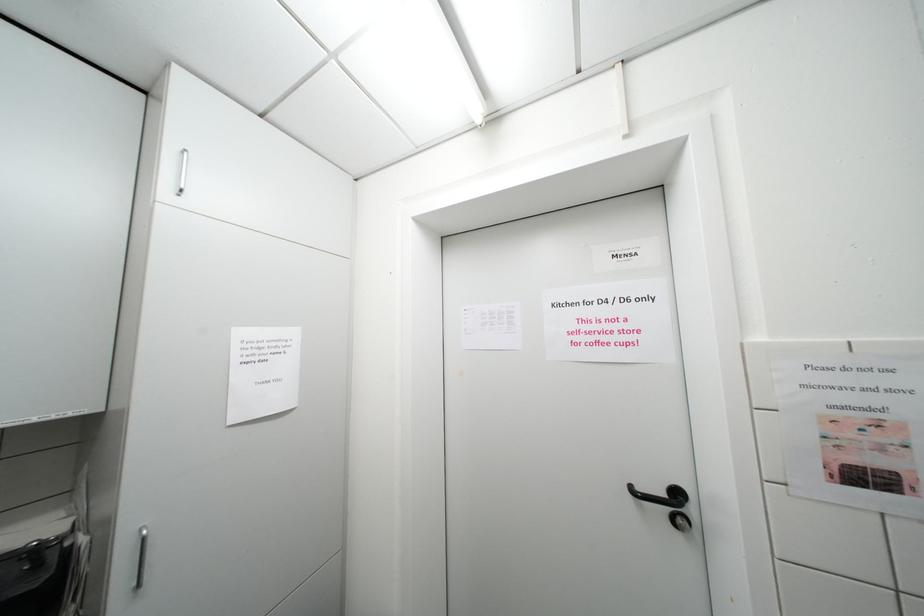
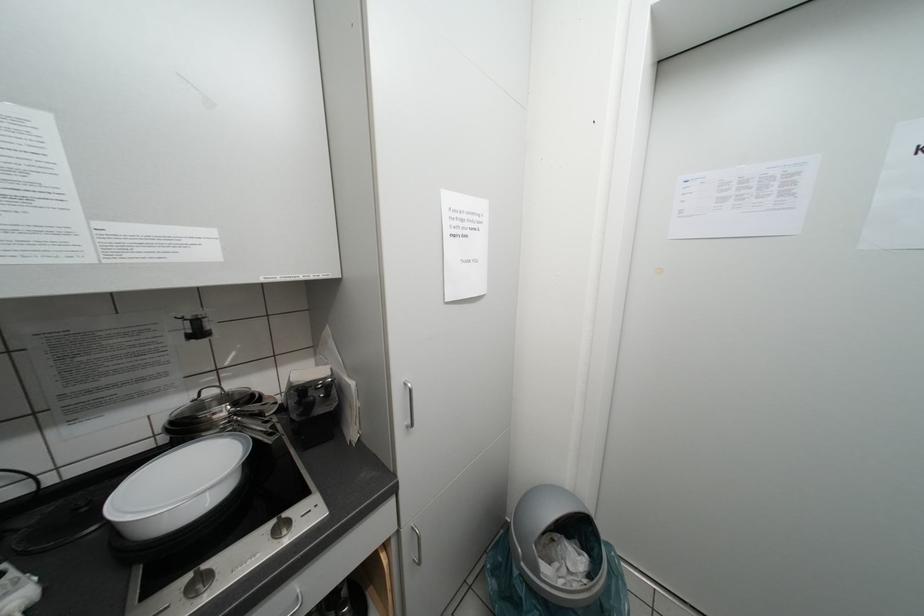
Question: The images are taken continuously from a first-person perspective. In which direction is your viewpoint rotating?

Choices:
 (A) Left
 (B) Right
 (C) Up
 (D) Down

Answer: (D)